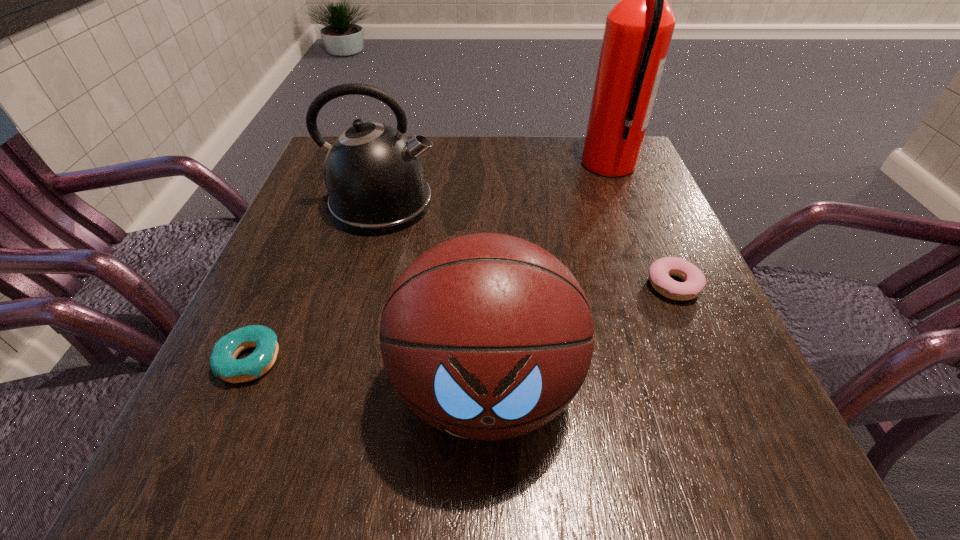
Where is `blank region between the left doughnut and the kettle`? This screenshot has height=540, width=960. blank region between the left doughnut and the kettle is located at coordinates click(315, 282).

The height and width of the screenshot is (540, 960). In order to click on object that is the third closest to the kettle in this screenshot , I will do `click(638, 31)`.

You are a GUI agent. You are given a task and a screenshot of the screen. Output one action in this format:
    pyautogui.click(x=<x>, y=<y>)
    Task: Click on the second closest object to the basketball
    The image size is (960, 540).
    Given the screenshot: What is the action you would take?
    pyautogui.click(x=223, y=362)

Identify the location of free spot that satisfies the following two spatial constraints: 1. on the spout of the kettle; 2. on the back side of the basketball. The height and width of the screenshot is (540, 960). (331, 388).

Locate an element on the screen. This screenshot has height=540, width=960. blank space that satisfies the following two spatial constraints: 1. at the nozzle of the tallest object; 2. on the left side of the right doughnut is located at coordinates (657, 286).

At what (x,y) coordinates should I click in order to perform the action: click on blank space that satisfies the following two spatial constraints: 1. on the spout of the kettle; 2. on the back side of the basketball. Please return your answer as a coordinate pair (x, y). Looking at the image, I should click on (331, 388).

I want to click on free location that satisfies the following two spatial constraints: 1. on the back side of the farther doughnut; 2. on the spout of the kettle, so click(x=638, y=205).

Where is `free space that satisfies the following two spatial constraints: 1. on the spout of the basketball; 2. on the left side of the kettle`? The height and width of the screenshot is (540, 960). free space that satisfies the following two spatial constraints: 1. on the spout of the basketball; 2. on the left side of the kettle is located at coordinates (331, 388).

You are a GUI agent. You are given a task and a screenshot of the screen. Output one action in this format:
    pyautogui.click(x=<x>, y=<y>)
    Task: Click on the free space that satisfies the following two spatial constraints: 1. on the back side of the farther doughnut; 2. on the spout of the kettle
    The height and width of the screenshot is (540, 960).
    Given the screenshot: What is the action you would take?
    pyautogui.click(x=638, y=205)

Find the location of a particular element. free space that satisfies the following two spatial constraints: 1. at the nozzle of the farther doughnut; 2. on the left side of the fire extinguisher is located at coordinates (657, 286).